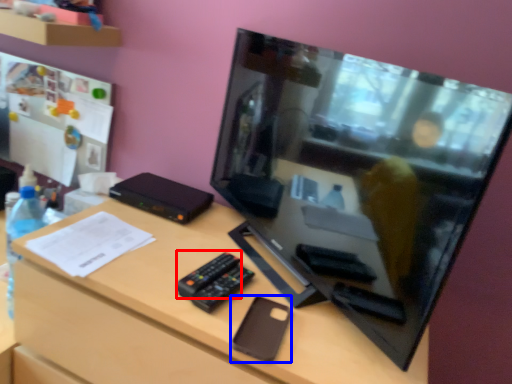
Question: Which of the following is the farthest to the observer, remote (highlighted by a red box) or gadget (highlighted by a blue box)?

Choices:
 (A) remote
 (B) gadget

Answer: (A)